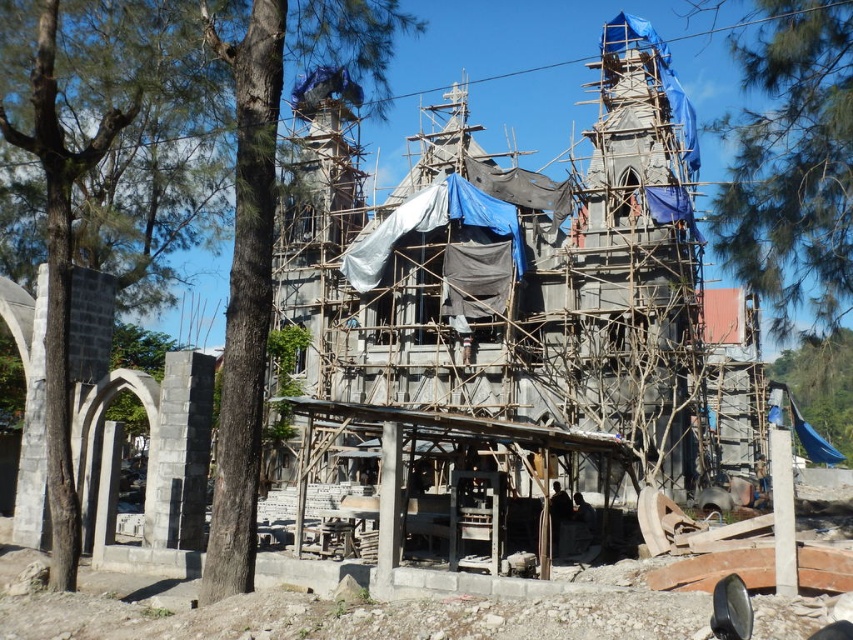
You are a construction worker standing at the center of the construction site. You need to locate the green leafy tree at left. Which direction should you face to see it?

The green leafy tree at left is located at coordinates (99, 163), so you should face the left direction to see it.

You are a construction worker standing at the base of the building. You notice two green leafy trees in the image. Which tree, the green leafy tree at left or the green leafy tree at upper right, is positioned higher up relative to the building?

The green leafy tree at left is positioned higher up relative to the building than the green leafy tree at upper right because it is located above it.

You are a construction worker standing at the base of the Gothic building under construction. You notice two points marked on the building structure. The first point is at coordinate point (137, 74) and the second is at point (821, 193). Which of these two points is physically closer to your current position?

Point (137, 74) is closer to the camera than point (821, 193), so the first point is closer to your current position.